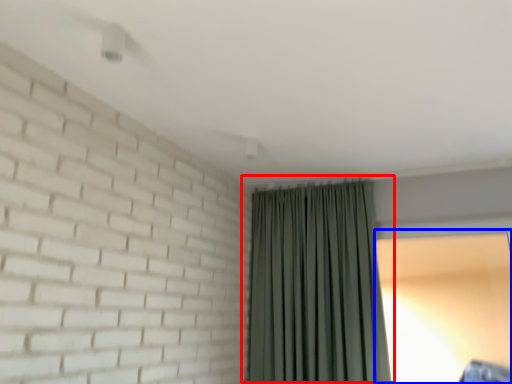
Question: Which object is further to the camera taking this photo, curtain (highlighted by a red box) or window screen (highlighted by a blue box)?

Choices:
 (A) curtain
 (B) window screen

Answer: (B)